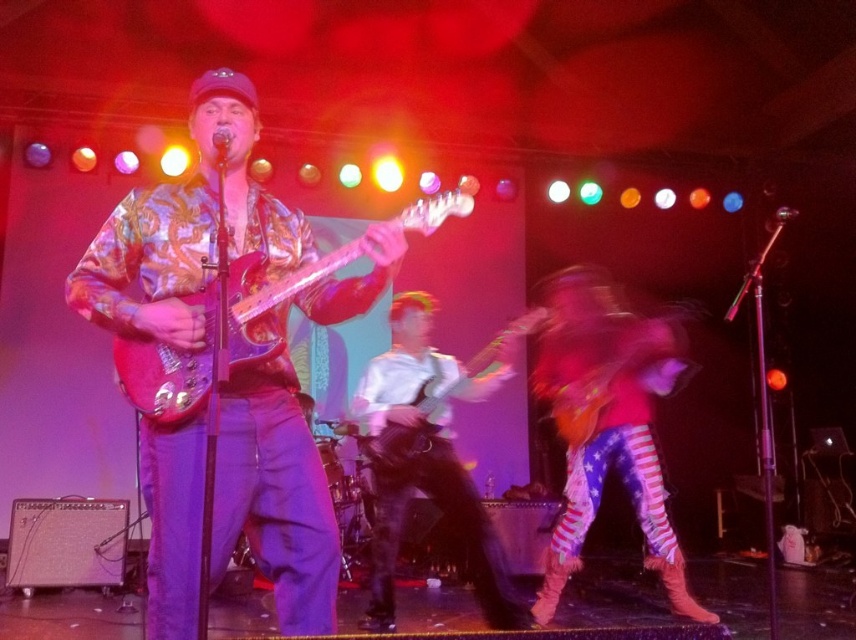
You are standing at the center of the stage and want to move towards the point that is closer to the audience. Which point should you move to, point (x=114, y=230) or point (x=471, y=387)?

Point (x=114, y=230) is in front of point (x=471, y=387), so you should move to point (x=114, y=230) to be closer to the audience.

You are a stagehand setting up equipment. You need to place a 24 inch wide amplifier between the shiny metallic guitar at center and the glossy wood guitar at center. Is there enough space between them to fit the amplifier?

The distance between the shiny metallic guitar at center and the glossy wood guitar at center is 22.60 inches, which is less than the 24 inch width of the amplifier. Therefore, the amplifier cannot be placed between them as there is insufficient space.

You are sitting in the audience and want to know which of the two points, point (580,337) or point (456,378), is closer to you. Can you determine this based on their positions?

Point (580,337) is closer to you than point (456,378) because it is further to the viewer.